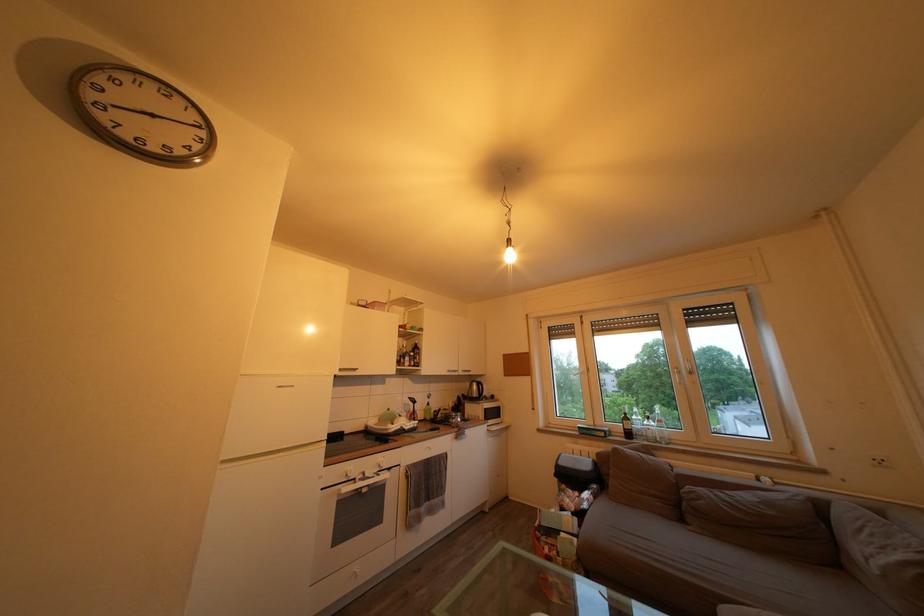
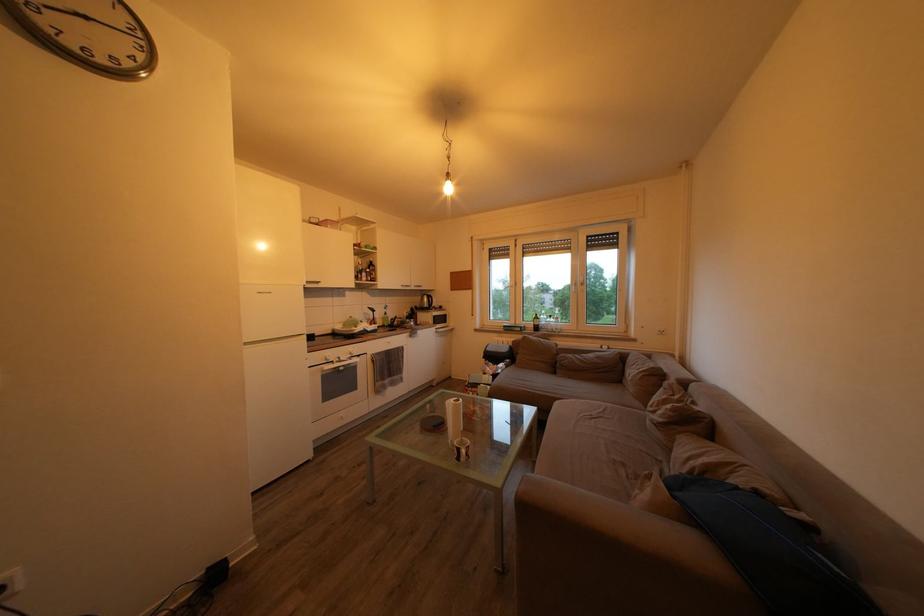
Locate, in the second image, the point that corresponds to [457,408] in the first image.

(412, 318)